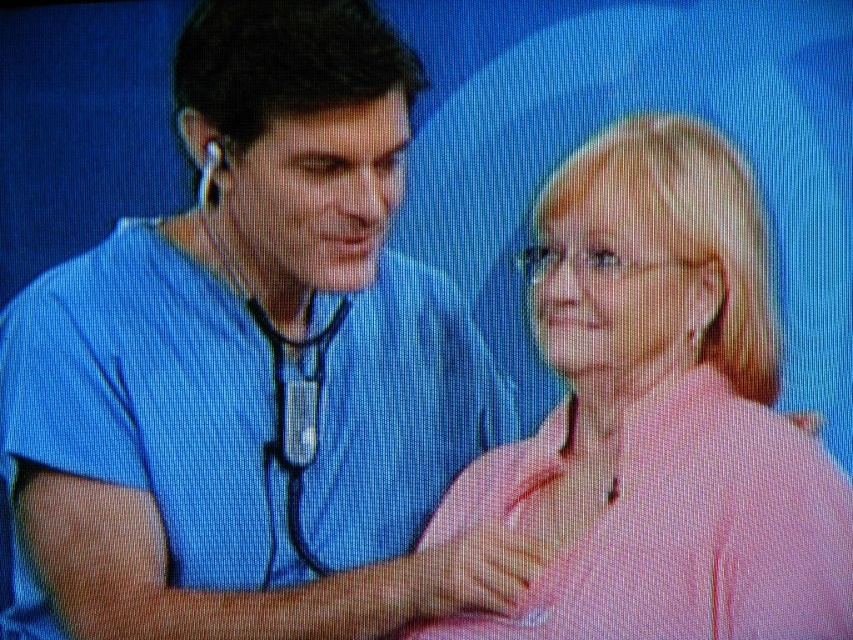
Question: Which point appears farthest from the camera in this image?

Choices:
 (A) (x=198, y=189)
 (B) (x=560, y=348)
 (C) (x=282, y=372)

Answer: (C)

Question: Which point appears farthest from the camera in this image?

Choices:
 (A) (351, 518)
 (B) (267, 502)

Answer: (A)

Question: Is pink fabric shirt at center positioned before matte black stethoscope at center?

Choices:
 (A) no
 (B) yes

Answer: (B)

Question: Is pink fabric shirt at center above matte black stethoscope at center?

Choices:
 (A) no
 (B) yes

Answer: (A)

Question: Can you confirm if matte blue shirt at center is smaller than pink fabric shirt at center?

Choices:
 (A) no
 (B) yes

Answer: (A)

Question: Which point is closer to the camera?

Choices:
 (A) matte blue shirt at center
 (B) matte black stethoscope at center
 (C) pink fabric shirt at center

Answer: (C)